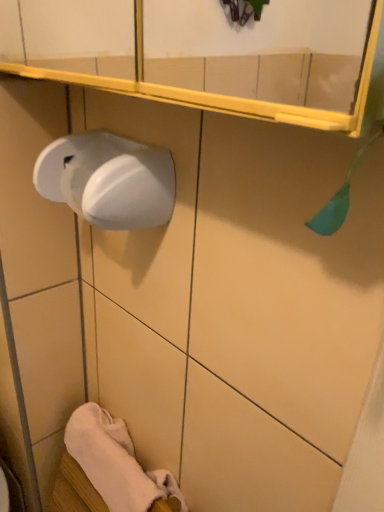
Question: From the image's perspective, is white glossy paper towel at left positioned above or below white soft towel at lower left?

Choices:
 (A) above
 (B) below

Answer: (A)

Question: In terms of size, does white glossy paper towel at left appear bigger or smaller than white soft towel at lower left?

Choices:
 (A) big
 (B) small

Answer: (B)

Question: Which object is positioned closest to the white glossy paper towel at left?

Choices:
 (A) white glossy soap dispenser at left
 (B) white soft towel at lower left

Answer: (A)

Question: Which object is positioned farthest from the white soft towel at lower left?

Choices:
 (A) white glossy paper towel at left
 (B) white glossy soap dispenser at left

Answer: (A)